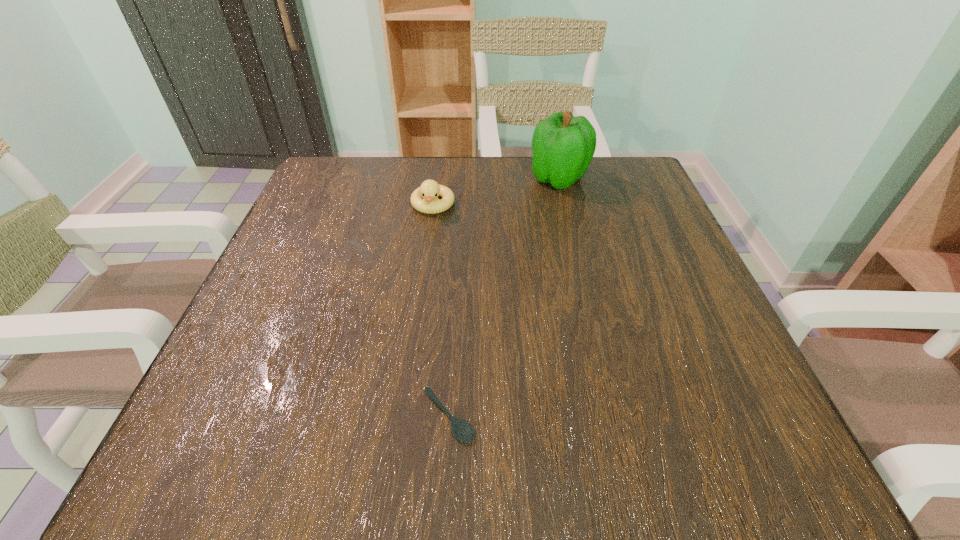
Where is `object that is at the near edge`? Image resolution: width=960 pixels, height=540 pixels. object that is at the near edge is located at coordinates (462, 430).

Identify the location of object located at the right edge. The image size is (960, 540). (563, 146).

Locate an element on the screen. Image resolution: width=960 pixels, height=540 pixels. object present at the far right corner is located at coordinates (563, 146).

Where is `vacant space at the far edge of the desktop`? The width and height of the screenshot is (960, 540). vacant space at the far edge of the desktop is located at coordinates (574, 188).

Identify the location of free space at the near edge of the desktop. Image resolution: width=960 pixels, height=540 pixels. (571, 463).

The width and height of the screenshot is (960, 540). In the image, there is a desktop. What are the coordinates of `vacant space at the left edge` in the screenshot? It's located at (272, 325).

Find the location of a particular element. The height and width of the screenshot is (540, 960). blank space at the right edge of the desktop is located at coordinates (646, 259).

Image resolution: width=960 pixels, height=540 pixels. What are the coordinates of `free region at the far left corner of the desktop` in the screenshot? It's located at (341, 194).

Identify the location of vacant area at the near left corner. This screenshot has width=960, height=540. (227, 451).

This screenshot has height=540, width=960. Find the location of `vacant region at the far right corner`. vacant region at the far right corner is located at coordinates (601, 177).